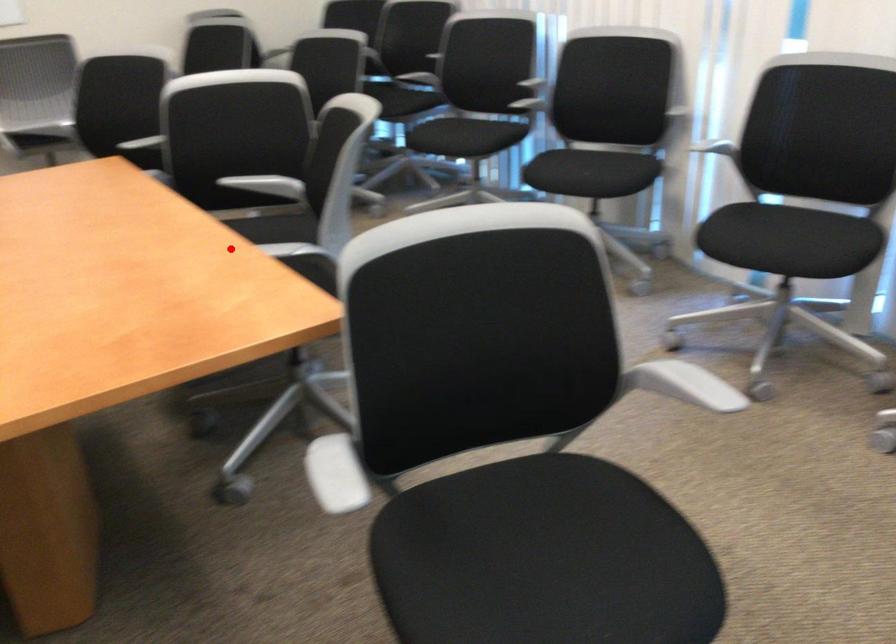
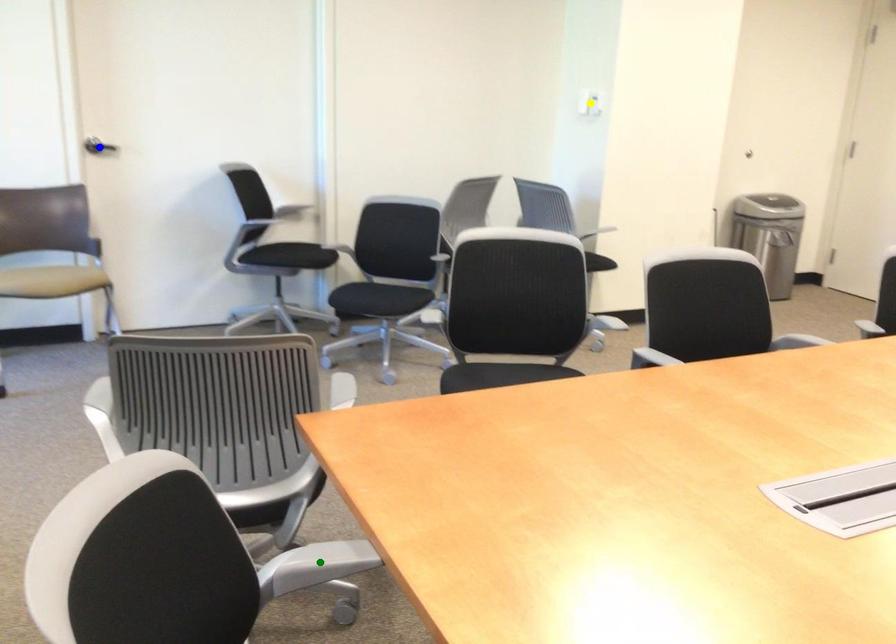
Question: I am providing you with two images of the same scene from different viewpoints. A red point is marked on the first image. You are given multiple points on the second image. Can you choose the point in image 2 that corresponds to the point in image 1?

Choices:
 (A) yellow point
 (B) blue point
 (C) green point

Answer: (C)